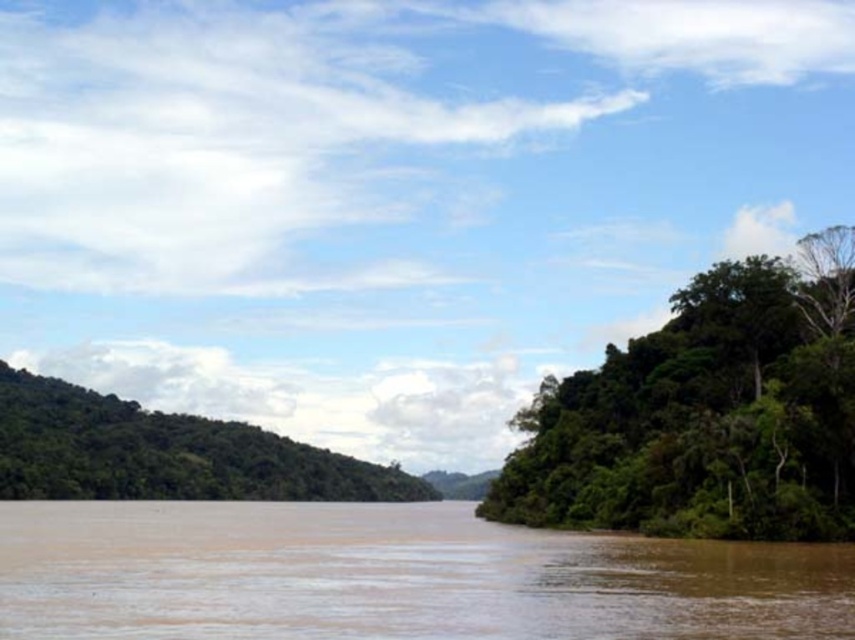
Which of these two, brown muddy water at center or green leafy trees at right, stands shorter?

brown muddy water at center

Does brown muddy water at center have a lesser width compared to green leafy trees at right?

No.

Is point (217, 570) positioned behind point (724, 310)?

No, it is in front of (724, 310).

Where is `brown muddy water at center`? This screenshot has height=640, width=855. brown muddy water at center is located at coordinates (x=393, y=577).

Who is taller, green leafy trees at right or green leafy forest at left?

With more height is green leafy forest at left.

Is green leafy trees at right above green leafy forest at left?

Yes.

Find the location of `green leafy trees at right`. green leafy trees at right is located at coordinates (706, 413).

Can you confirm if brown muddy water at center is positioned below green leafy forest at left?

No.

The height and width of the screenshot is (640, 855). I want to click on brown muddy water at center, so click(x=393, y=577).

Where is `brown muddy water at center`? This screenshot has height=640, width=855. brown muddy water at center is located at coordinates (393, 577).